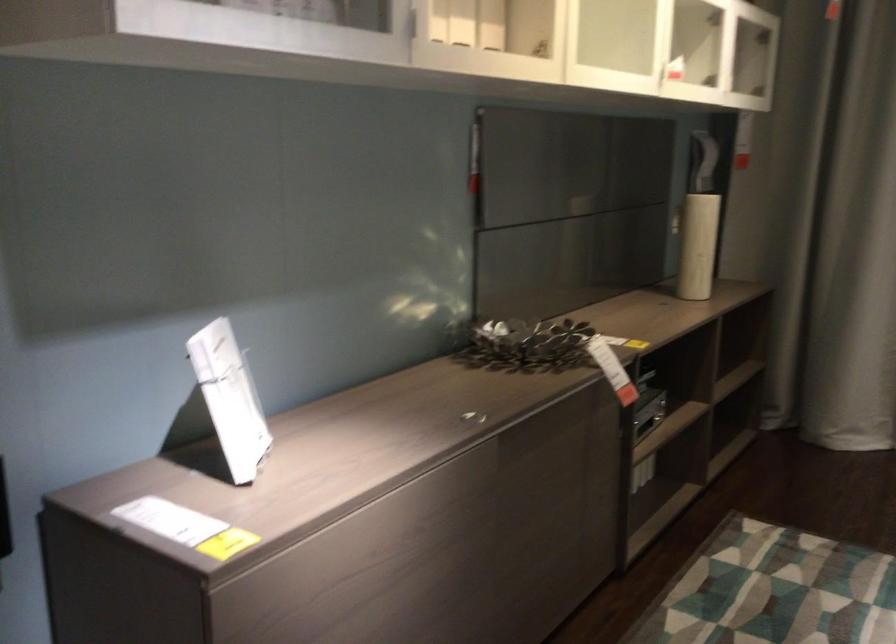
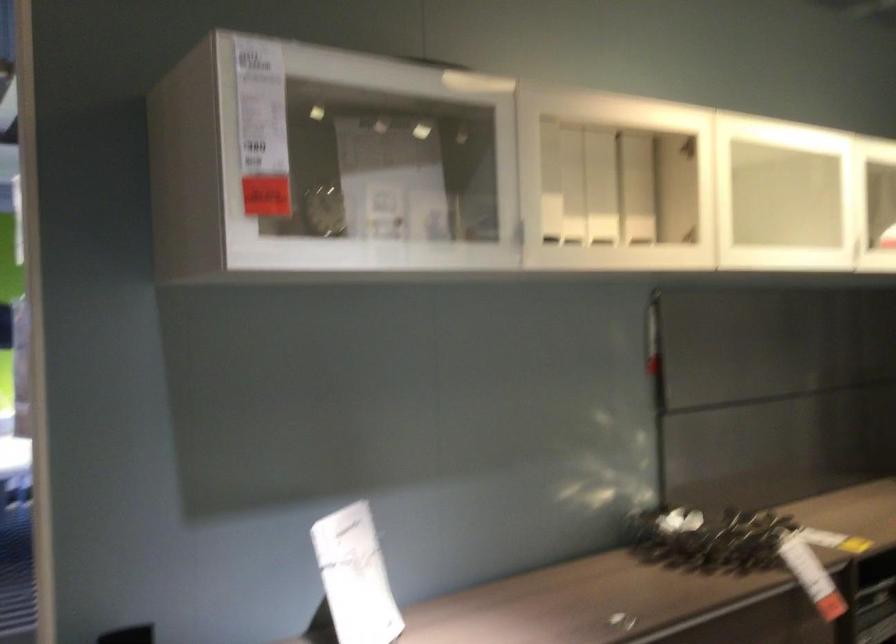
Question: The camera is either moving clockwise (left) or counter-clockwise (right) around the object. The first image is from the beginning of the video and the second image is from the end. Is the camera moving left or right when shooting the video?

Choices:
 (A) Left
 (B) Right

Answer: (B)